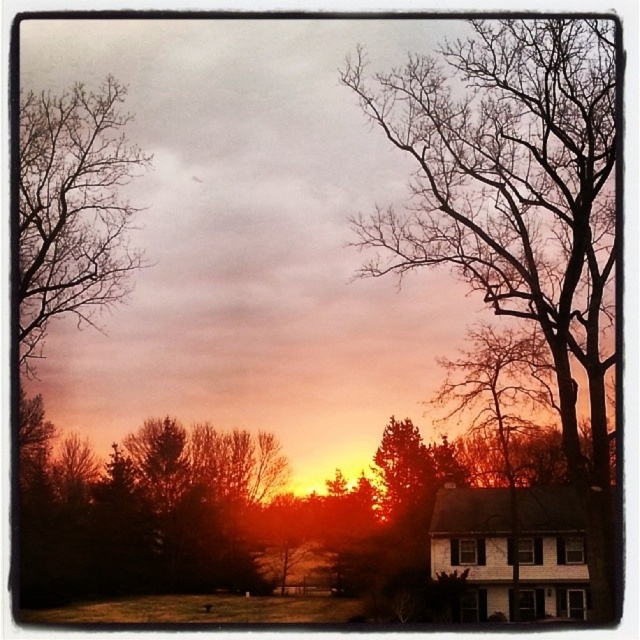
In the sunset scene, there is a point labeled as point [516,221]. What does this point represent?

The point [516,221] represents the location of the bare branches at center in the image.

You are an artist sketching the sunset scene and need to decide which part of the branches to emphasize. Based on the image, which of the bare branches at center or the bare branches at upper left should you focus on if you want to highlight the wider section?

The bare branches at center are wider than the bare branches at upper left, so you should focus on the bare branches at center to highlight the wider section.

You are standing at the point with coordinates point (26, 188) and want to walk to the point with coordinates point (420, 163). According to the scene, will the path between these two points be blocked by any objects?

Point (420, 163) is behind point (26, 188), so the path between them will be blocked by point (26, 188).